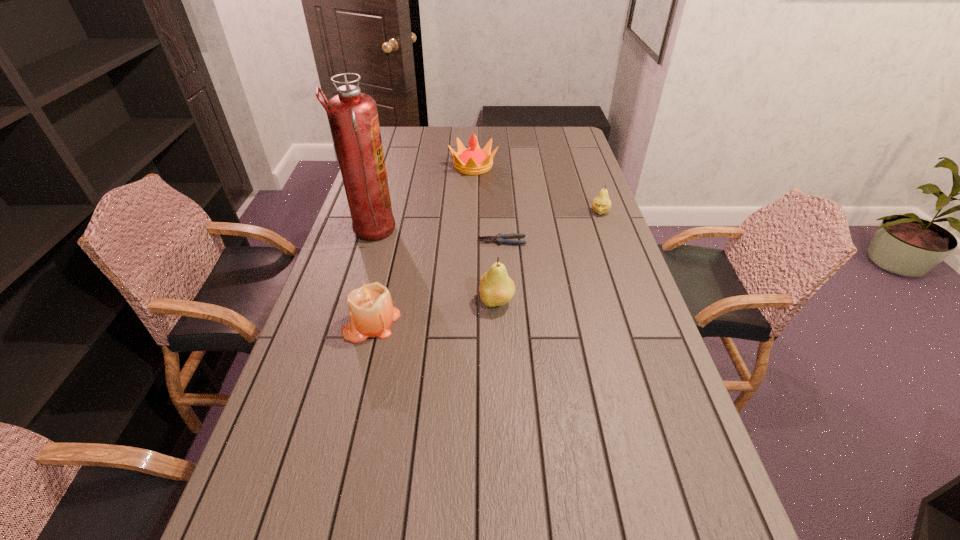
Where is `the left pear`? This screenshot has height=540, width=960. the left pear is located at coordinates (496, 288).

At what (x,y) coordinates should I click in order to perform the action: click on the nearer pear. Please return your answer as a coordinate pair (x, y). The height and width of the screenshot is (540, 960). Looking at the image, I should click on (496, 288).

In order to click on the right pear in this screenshot , I will do `click(601, 204)`.

This screenshot has height=540, width=960. Find the location of `the farther pear`. the farther pear is located at coordinates (601, 204).

The image size is (960, 540). Identify the location of fire extinguisher. (353, 116).

Locate an element on the screen. the farthest object is located at coordinates (473, 161).

Where is `the shortest object`? the shortest object is located at coordinates [x=500, y=239].

The image size is (960, 540). Find the location of `candle`. candle is located at coordinates (371, 310).

Where is `free location located 0.170m on the right of the nearer pear`? This screenshot has width=960, height=540. free location located 0.170m on the right of the nearer pear is located at coordinates (574, 302).

At what (x,y) coordinates should I click in order to perform the action: click on free spot located 0.080m on the front of the right pear. Please return your answer as a coordinate pair (x, y). Looking at the image, I should click on (607, 231).